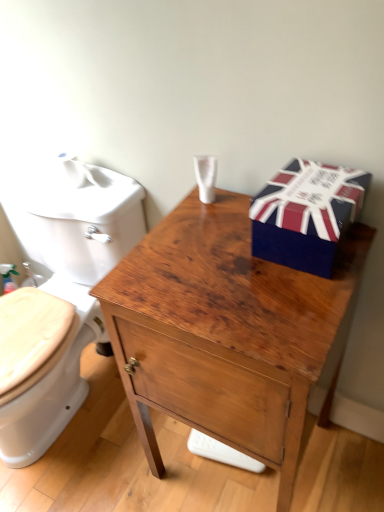
Locate an element on the screen. free location in front of union jack-patterned cardboard box at upper right is located at coordinates (302, 293).